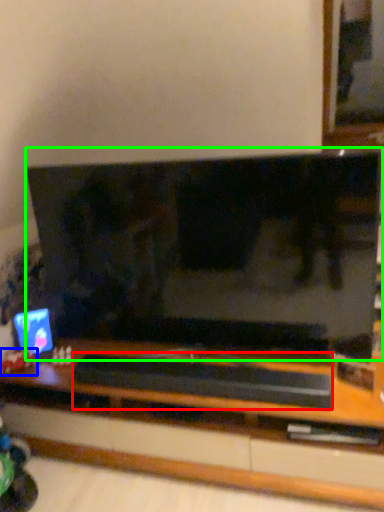
Question: Considering the real-world distances, which object is closest to wide (highlighted by a red box)? toy (highlighted by a blue box) or television (highlighted by a green box).

Choices:
 (A) toy
 (B) television

Answer: (B)